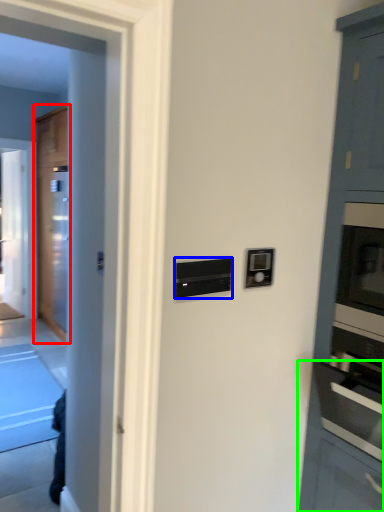
Question: Which object is the closest to the door (highlighted by a red box)? Choose among these: appliance (highlighted by a blue box) or cabinetry (highlighted by a green box).

Choices:
 (A) appliance
 (B) cabinetry

Answer: (B)